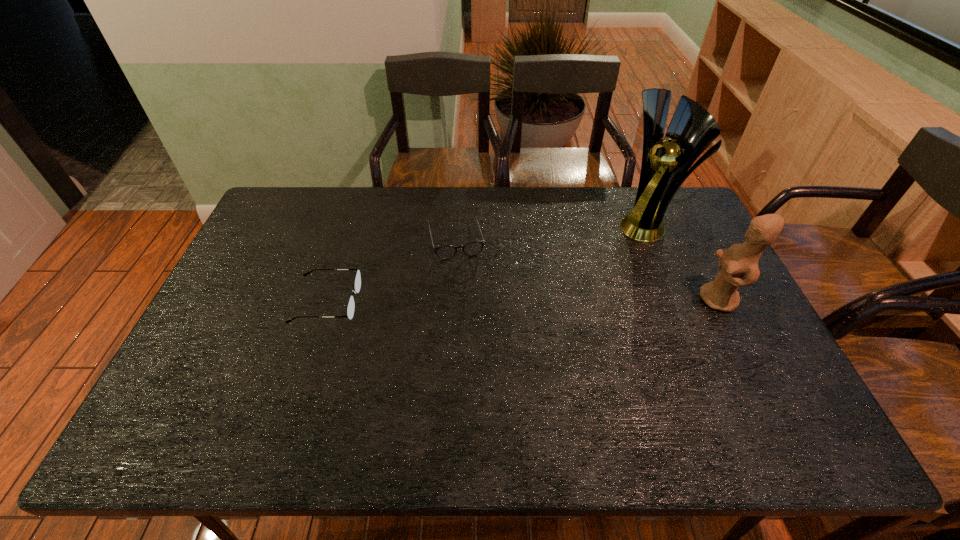
Locate an element on the screen. The image size is (960, 540). object at the far right corner is located at coordinates (665, 165).

At what (x,y) coordinates should I click in order to perform the action: click on free space at the far edge of the desktop. Please return your answer as a coordinate pair (x, y). Looking at the image, I should click on (450, 210).

The image size is (960, 540). I want to click on vacant space at the near edge of the desktop, so click(321, 402).

The height and width of the screenshot is (540, 960). I want to click on free space at the left edge of the desktop, so click(187, 355).

This screenshot has height=540, width=960. I want to click on free space at the right edge, so click(x=736, y=326).

Identify the location of vacant space at the far left corner. (301, 205).

I want to click on unoccupied position between the tallest object and the third shortest object, so click(x=684, y=262).

Where is `vacant space that is in between the tallest object and the third shortest object`? The height and width of the screenshot is (540, 960). vacant space that is in between the tallest object and the third shortest object is located at coordinates (684, 262).

You are a GUI agent. You are given a task and a screenshot of the screen. Output one action in this format:
    pyautogui.click(x=<x>, y=<y>)
    Task: Click on the blank region between the tallest object and the figurine
    This screenshot has height=540, width=960.
    Given the screenshot: What is the action you would take?
    pyautogui.click(x=684, y=262)

Where is `vacant region between the left spectacles and the right spectacles`? The image size is (960, 540). vacant region between the left spectacles and the right spectacles is located at coordinates (391, 271).